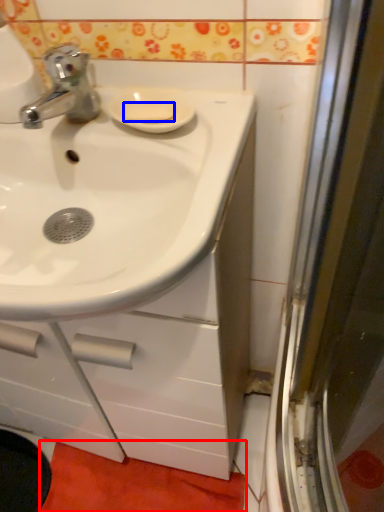
Question: Which object is closer to the camera taking this photo, bath mat (highlighted by a red box) or soap (highlighted by a blue box)?

Choices:
 (A) bath mat
 (B) soap

Answer: (B)